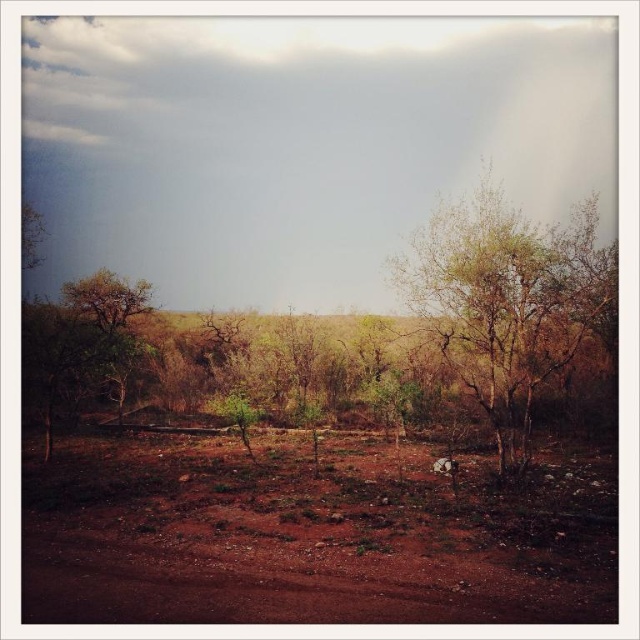
Question: Is brown soil at center closer to the viewer compared to green leafy tree at center?

Choices:
 (A) yes
 (B) no

Answer: (A)

Question: Can you confirm if brown soil at center is positioned to the right of green leafy tree at center?

Choices:
 (A) yes
 (B) no

Answer: (B)

Question: Which point appears closest to the camera in this image?

Choices:
 (A) (564, 605)
 (B) (515, 212)

Answer: (A)

Question: Which of the following is the closest to the observer?

Choices:
 (A) brown soil at center
 (B) green leafy tree at center

Answer: (A)

Question: Is brown soil at center smaller than green leafy tree at center?

Choices:
 (A) no
 (B) yes

Answer: (B)